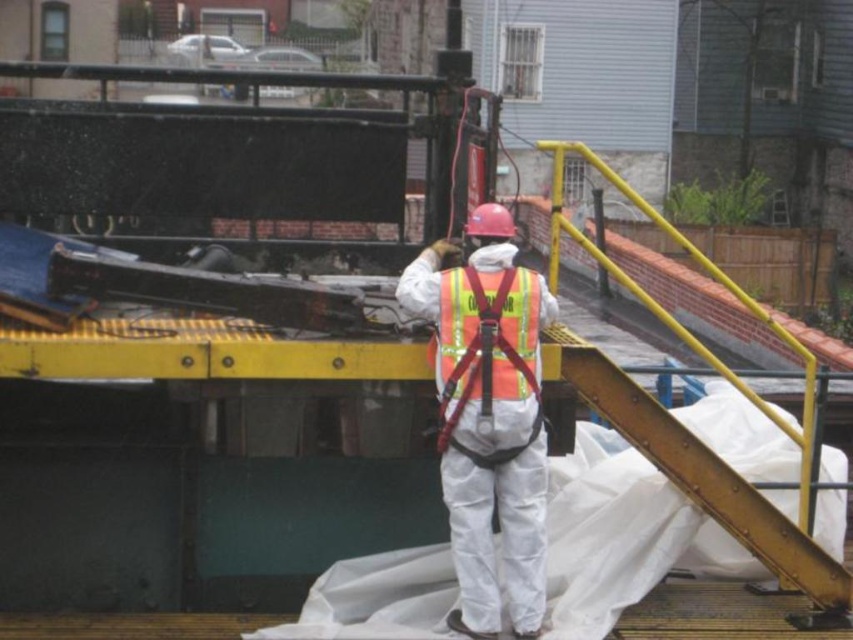
Question: Can you confirm if white reflective safety vest at center is positioned above reflective orange safety vest at center?

Choices:
 (A) no
 (B) yes

Answer: (A)

Question: Which point appears farthest from the camera in this image?

Choices:
 (A) coord(451,296)
 (B) coord(463,477)

Answer: (B)

Question: Is white reflective safety vest at center thinner than reflective orange safety vest at center?

Choices:
 (A) no
 (B) yes

Answer: (A)

Question: Which object is farther from the camera taking this photo?

Choices:
 (A) white reflective safety vest at center
 (B) reflective orange safety vest at center

Answer: (B)

Question: Can you confirm if white reflective safety vest at center is bigger than reflective orange safety vest at center?

Choices:
 (A) no
 (B) yes

Answer: (B)